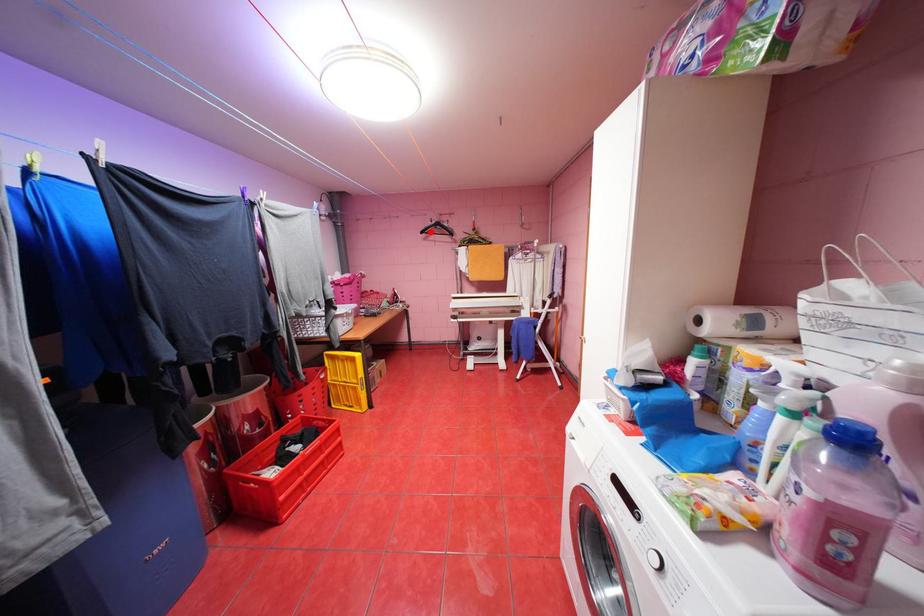
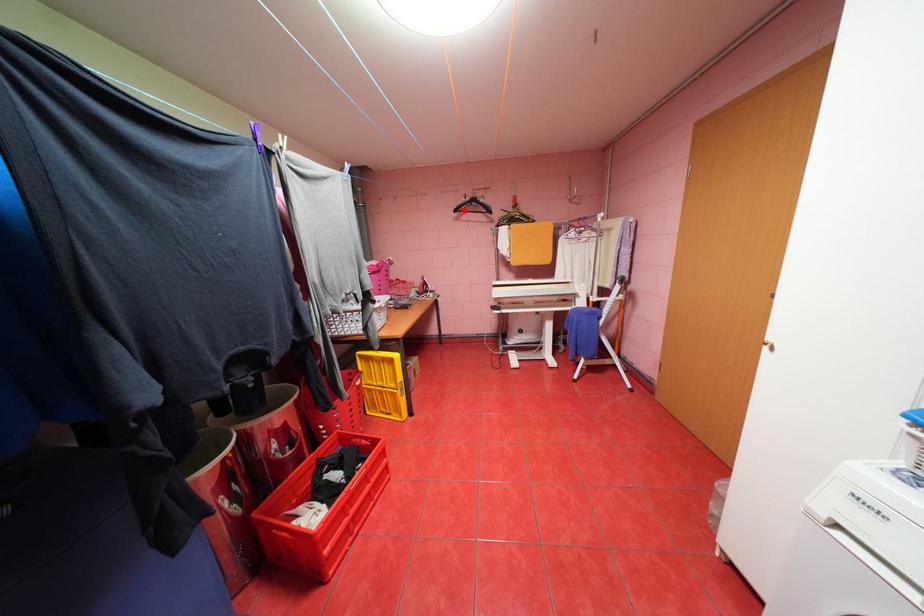
I am providing you with two images of the same scene from different viewpoints. A red point is marked on the first image and another point is marked on the second image. Is the marked point in image1 the same physical position as the marked point in image2?

Yes